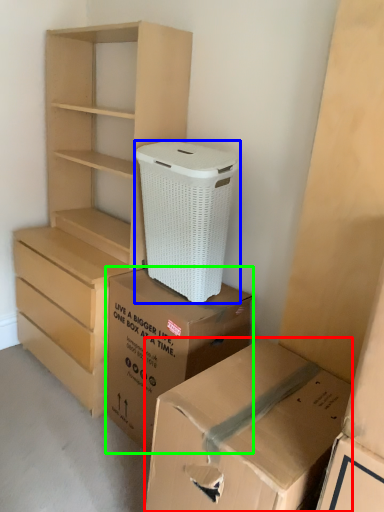
Question: Estimate the real-world distances between objects in this image. Which object is farther from box (highlighted by a red box), shoe box (highlighted by a blue box) or box (highlighted by a green box)?

Choices:
 (A) shoe box
 (B) box

Answer: (A)